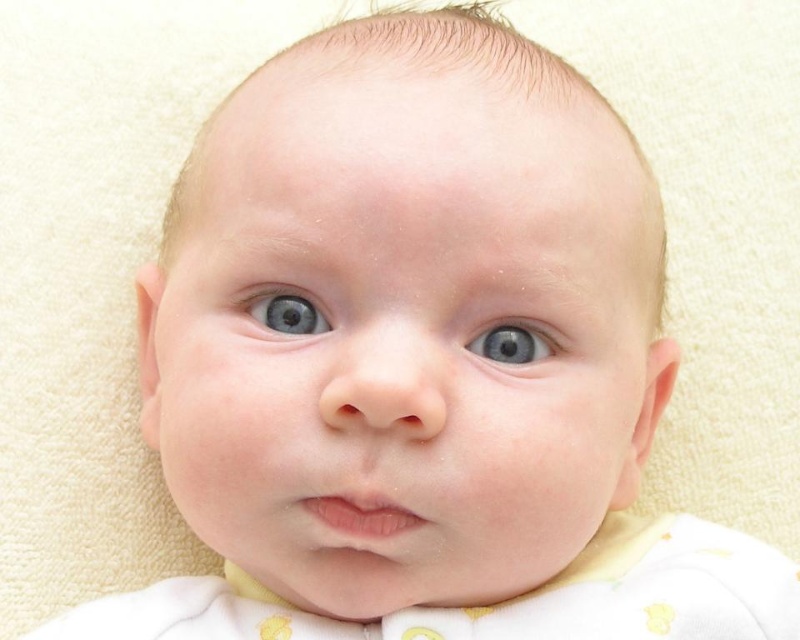
Is point (528, 358) behind point (264, 316)?

No, (528, 358) is closer to viewer.

Is blue smooth eye at center above blue glossy eye at center?

No.

Between point (528, 355) and point (274, 289), which one is positioned in front?

Positioned in front is point (528, 355).

Locate an element on the screen. This screenshot has width=800, height=640. blue smooth eye at center is located at coordinates (512, 342).